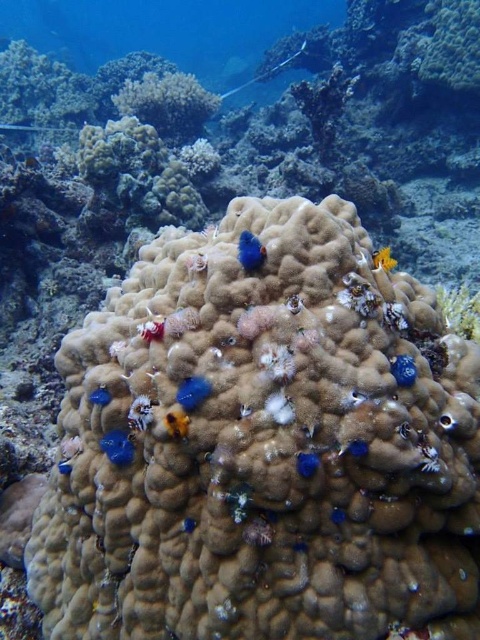
Is smooth yellow fish at center positioned before yellow matte coral at upper right?

Yes, smooth yellow fish at center is in front of yellow matte coral at upper right.

How much distance is there between smooth yellow fish at center and yellow matte coral at upper right?

smooth yellow fish at center is 2.02 meters away from yellow matte coral at upper right.

The width and height of the screenshot is (480, 640). Describe the element at coordinates (177, 422) in the screenshot. I see `smooth yellow fish at center` at that location.

Find the location of a particular element. The height and width of the screenshot is (640, 480). smooth yellow fish at center is located at coordinates (x=177, y=422).

Does smooth blue fish at center have a greater height compared to smooth yellow fish at center?

Correct, smooth blue fish at center is much taller as smooth yellow fish at center.

Is point (194, 385) farther from viewer compared to point (173, 412)?

That is False.

You are a GUI agent. You are given a task and a screenshot of the screen. Output one action in this format:
    pyautogui.click(x=<x>, y=<y>)
    Task: Click on the smooth blue fish at center
    
    Given the screenshot: What is the action you would take?
    pyautogui.click(x=192, y=392)

Does blue rubber fish at lower left have a lesser height compared to blue matte coral at center?

Correct, blue rubber fish at lower left is not as tall as blue matte coral at center.

Between blue rubber fish at lower left and blue matte coral at center, which one has more height?

With more height is blue matte coral at center.

Who is more forward, (106,451) or (255,250)?

Positioned in front is point (255,250).

The image size is (480, 640). What are the coordinates of `blue rubber fish at lower left` in the screenshot? It's located at (118, 448).